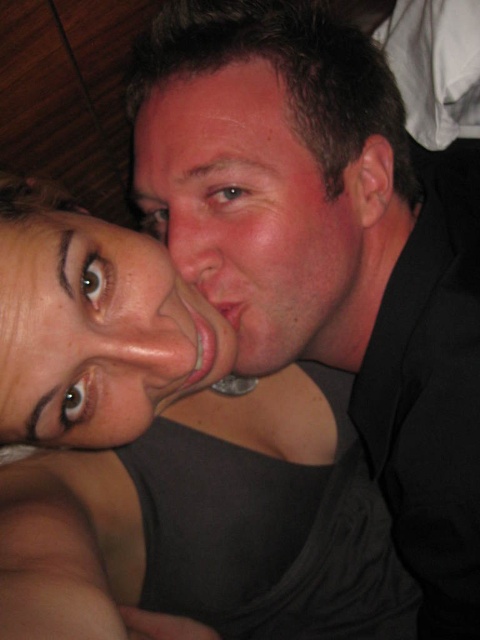
Is smooth skin face at center bigger than matte skin face at lower left?

Correct, smooth skin face at center is larger in size than matte skin face at lower left.

You are a GUI agent. You are given a task and a screenshot of the screen. Output one action in this format:
    pyautogui.click(x=<x>, y=<y>)
    Task: Click on the smooth skin face at center
    
    Given the screenshot: What is the action you would take?
    pyautogui.click(x=252, y=216)

Does matte black shirt at upper right appear over matte skin face at lower left?

Indeed, matte black shirt at upper right is positioned over matte skin face at lower left.

Between matte black shirt at upper right and matte skin face at lower left, which one appears on the left side from the viewer's perspective?

matte skin face at lower left is more to the left.

Who is more forward, (x=336, y=221) or (x=211, y=324)?

Positioned in front is point (x=211, y=324).

Locate an element on the screen. The image size is (480, 640). matte black shirt at upper right is located at coordinates (328, 248).

Is matte black tank top at center to the left of matte skin face at lower left from the viewer's perspective?

No, matte black tank top at center is not to the left of matte skin face at lower left.

Is point (141, 404) positioned behind point (7, 340)?

Yes, it is behind point (7, 340).

Who is more forward, (228,451) or (144,240)?

Positioned in front is point (144,240).

At what (x,y) coordinates should I click in order to perform the action: click on matte black tank top at center. Please return your answer as a coordinate pair (x, y). Looking at the image, I should click on (171, 452).